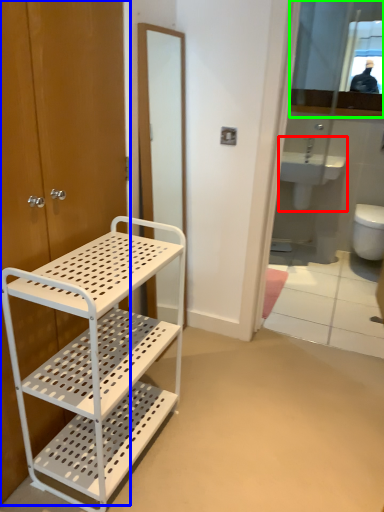
Question: Which is nearer to the sink (highlighted by a red box)? door (highlighted by a blue box) or mirror (highlighted by a green box).

Choices:
 (A) door
 (B) mirror

Answer: (B)